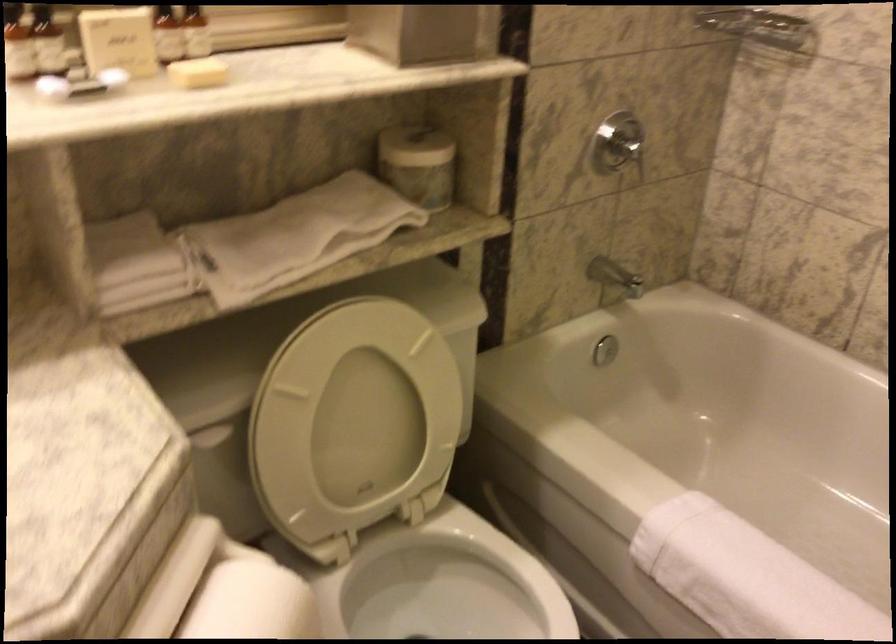
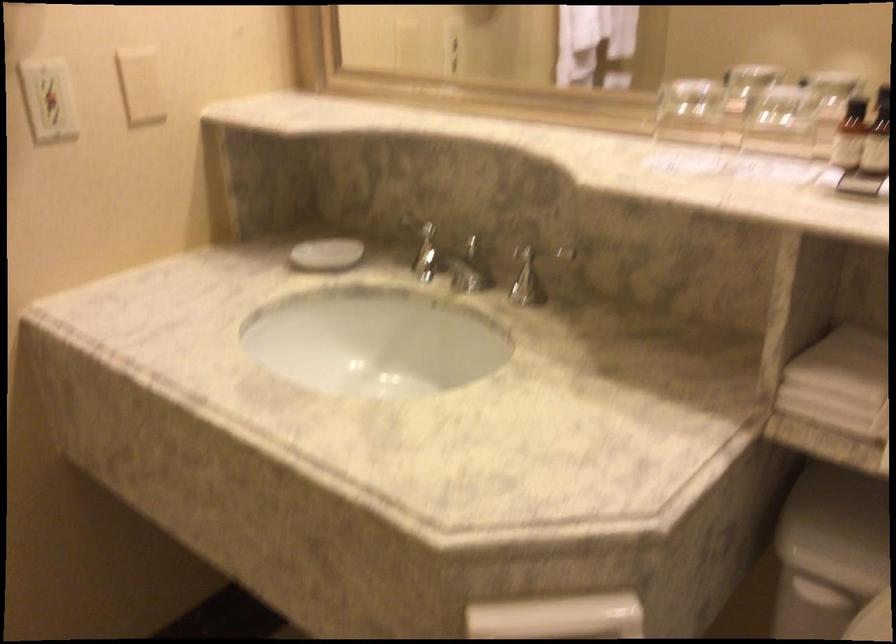
Find the pixel in the second image that matches pixel 128 274 in the first image.

(840, 383)